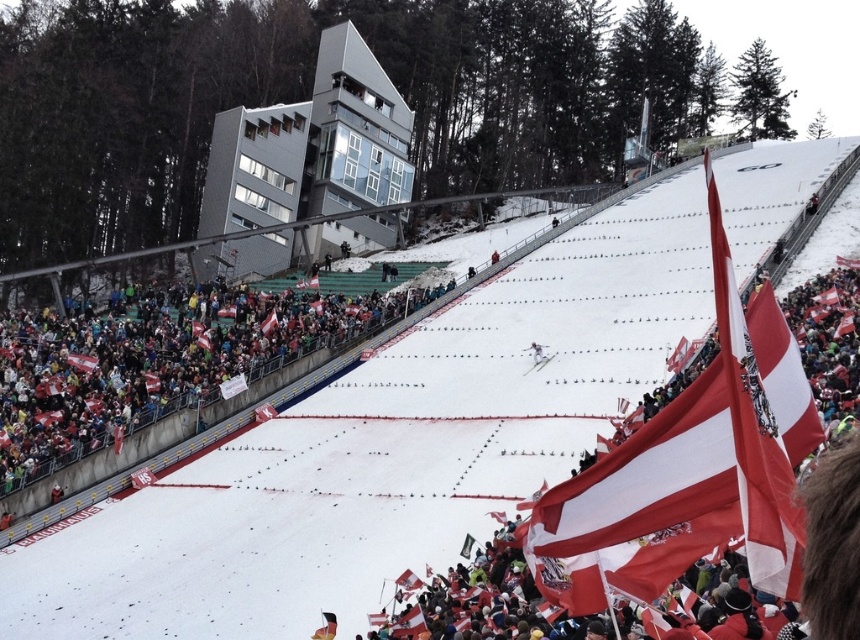
You are a photographer at the winter sports event. You want to take a photo of the white glossy snowboarder at center without any obstructions. Is the metallic gray building at upper center blocking your view of the snowboarder?

The white glossy snowboarder at center is behind the metallic gray building at upper center, so the building is blocking the view of the snowboarder.